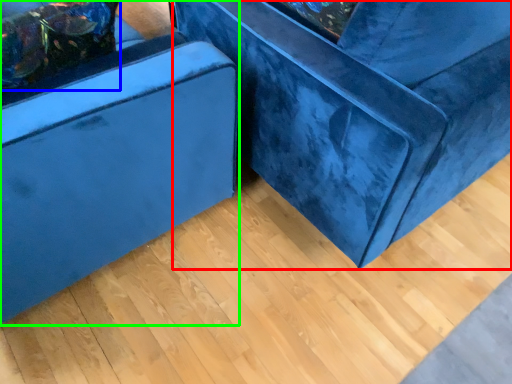
Question: Estimate the real-world distances between objects in this image. Which object is farther from furniture (highlighted by a red box), pillow (highlighted by a blue box) or furniture (highlighted by a green box)?

Choices:
 (A) pillow
 (B) furniture

Answer: (A)